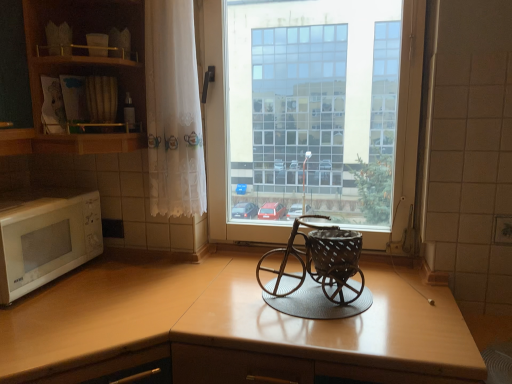
You are a GUI agent. You are given a task and a screenshot of the screen. Output one action in this format:
    pyautogui.click(x=<x>, y=<y>)
    Task: Click on the vacant region above wooden at center (from a real-world perspective)
    
    Given the screenshot: What is the action you would take?
    pyautogui.click(x=333, y=309)